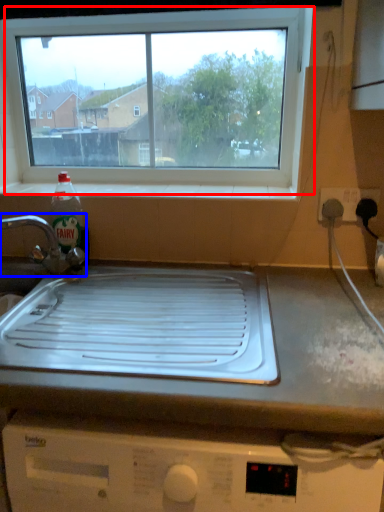
Question: Which object appears farthest to the camera in this image, window (highlighted by a red box) or tap (highlighted by a blue box)?

Choices:
 (A) window
 (B) tap

Answer: (A)